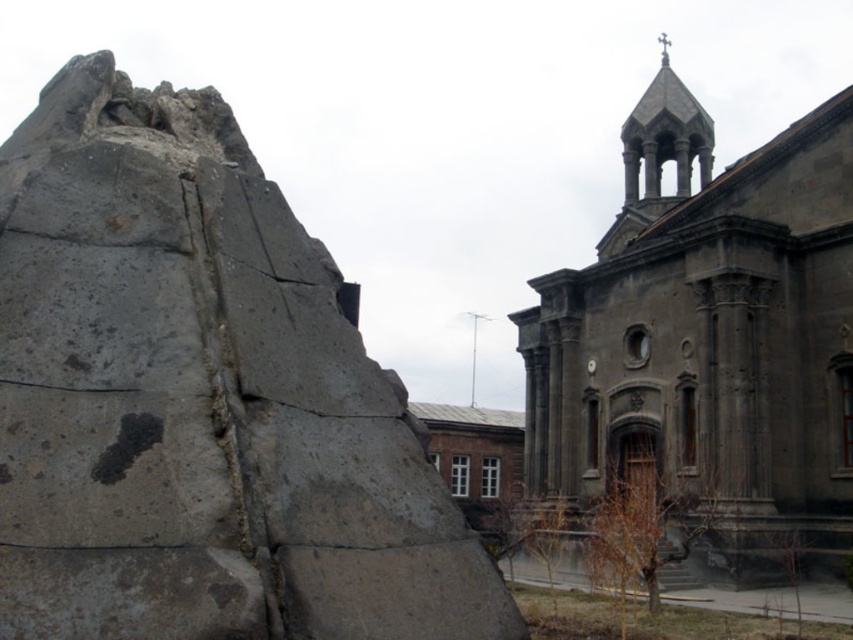
Question: Which object is farther from the camera taking this photo?

Choices:
 (A) dark gray stone church at center
 (B) gray rough stone at left

Answer: (A)

Question: Considering the relative positions of gray rough stone at left and dark gray stone church at center in the image provided, where is gray rough stone at left located with respect to dark gray stone church at center?

Choices:
 (A) right
 (B) left

Answer: (B)

Question: Which of the following is the farthest from the observer?

Choices:
 (A) gray rough stone at left
 (B) dark gray stone church at center

Answer: (B)

Question: Observing the image, what is the correct spatial positioning of gray rough stone at left in reference to dark gray stone church at center?

Choices:
 (A) above
 (B) below

Answer: (B)

Question: Can you confirm if gray rough stone at left is wider than dark gray stone church at center?

Choices:
 (A) yes
 (B) no

Answer: (B)